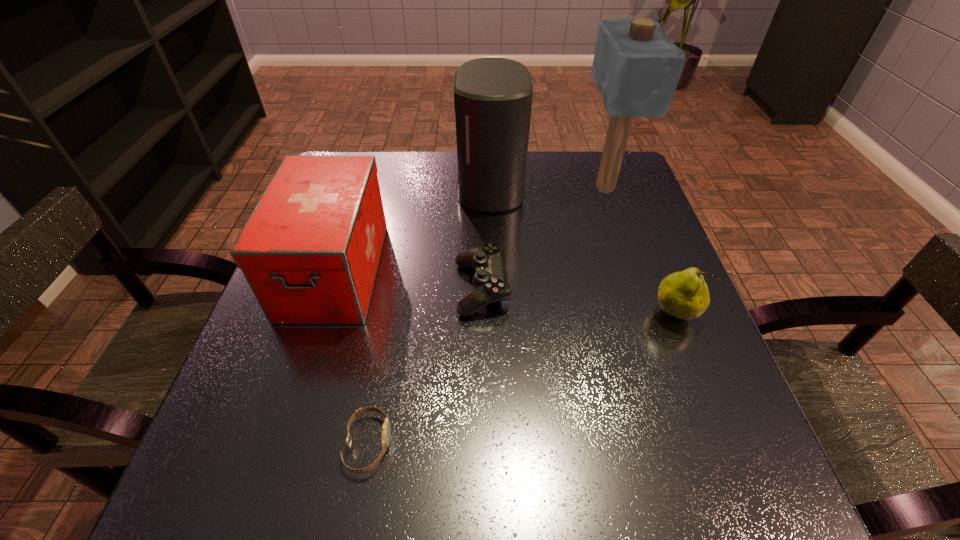
At what (x,y) coordinates should I click in order to perform the action: click on free spot between the second shortest object and the pear. Please return your answer as a coordinate pair (x, y). This screenshot has width=960, height=540. Looking at the image, I should click on (578, 301).

Where is `free point between the fifth shortest object and the fifth tallest object`? The image size is (960, 540). free point between the fifth shortest object and the fifth tallest object is located at coordinates (486, 238).

This screenshot has height=540, width=960. I want to click on free spot between the leftmost object and the control, so click(x=408, y=280).

Locate an element on the screen. The width and height of the screenshot is (960, 540). blank region between the fourth shortest object and the watch is located at coordinates (351, 357).

Locate an element on the screen. Image resolution: width=960 pixels, height=540 pixels. free space between the tallest object and the first-aid kit is located at coordinates (469, 229).

Find the location of `free point between the control and the second tallest object`. free point between the control and the second tallest object is located at coordinates (486, 238).

What are the coordinates of `vacant region between the nearest object and the second shortest object` in the screenshot? It's located at [x=425, y=366].

Select which object is the fifth closest to the fourth shortest object. Please provide its 2D coordinates. Your answer should be formatted as a tuple, i.e. [(x, y)], where the tuple contains the x and y coordinates of a point satisfying the conditions above.

[(684, 295)]

At what (x,y) coordinates should I click in order to perform the action: click on the third closest object to the first-aid kit. Please return your answer as a coordinate pair (x, y). Looking at the image, I should click on (386, 429).

Where is `vacant space that satisfies the following two spatial constraints: 1. on the handle side of the fourth shortest object; 2. on the left side of the control`? This screenshot has height=540, width=960. vacant space that satisfies the following two spatial constraints: 1. on the handle side of the fourth shortest object; 2. on the left side of the control is located at coordinates (329, 288).